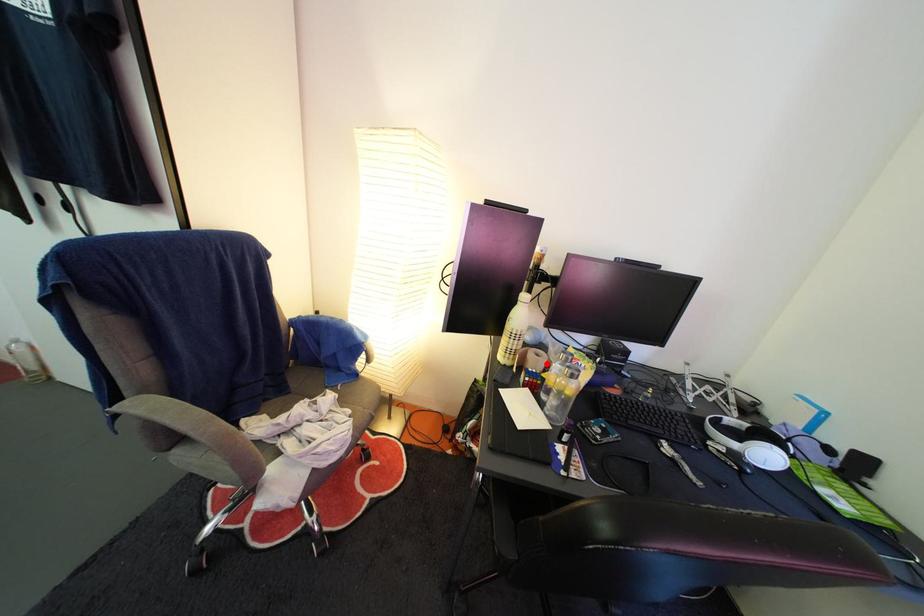
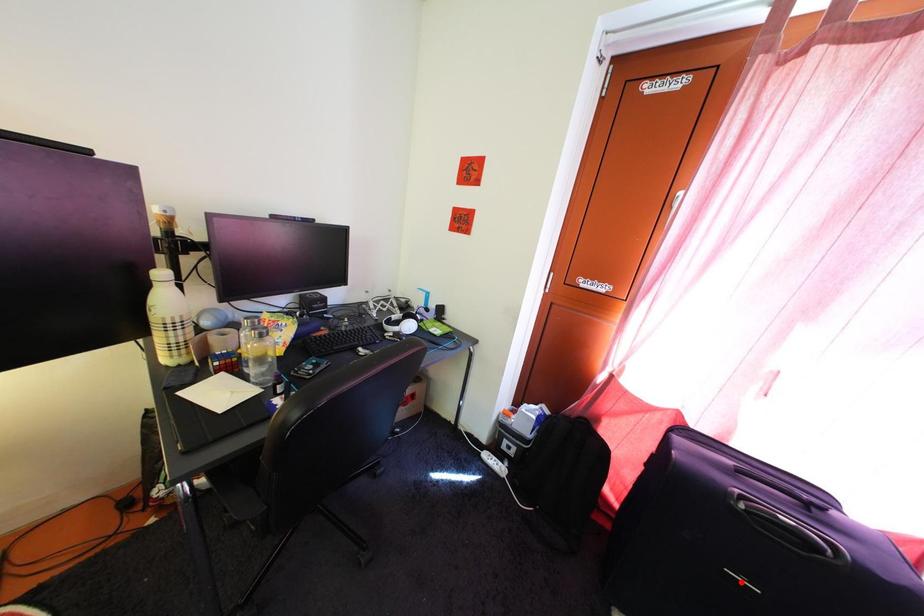
I am providing you with two images of the same scene from different viewpoints. A red point is marked on the first image and another point is marked on the second image. Do the highlighted points in image1 and image2 indicate the same real-world spot?

No